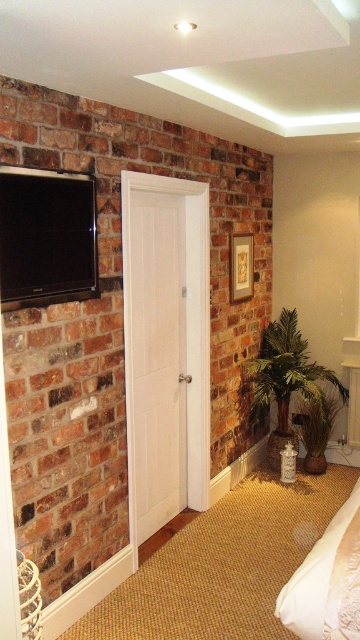
The image size is (360, 640). Describe the element at coordinates (326, 580) in the screenshot. I see `white textured bed at lower right` at that location.

Who is taller, white textured bed at lower right or green leafy plant at lower right?

With more height is green leafy plant at lower right.

This screenshot has height=640, width=360. Find the location of `white textured bed at lower right`. white textured bed at lower right is located at coordinates (326, 580).

Does green leafy plant at lower right appear over green leafy plant at center?

Indeed, green leafy plant at lower right is positioned over green leafy plant at center.

Is point (343, 394) positioned in front of point (339, 406)?

Yes, point (343, 394) is in front of point (339, 406).

Which is behind, point (272, 433) or point (335, 381)?

The point (272, 433) is more distant.

The image size is (360, 640). I want to click on green leafy plant at lower right, so point(285,381).

Consider the image. Does white textured bed at lower right have a greater height compared to green leafy plant at center?

No, white textured bed at lower right is not taller than green leafy plant at center.

Between point (329, 604) and point (324, 413), which one is positioned behind?

Point (324, 413)

The image size is (360, 640). Identify the location of white textured bed at lower right. (326, 580).